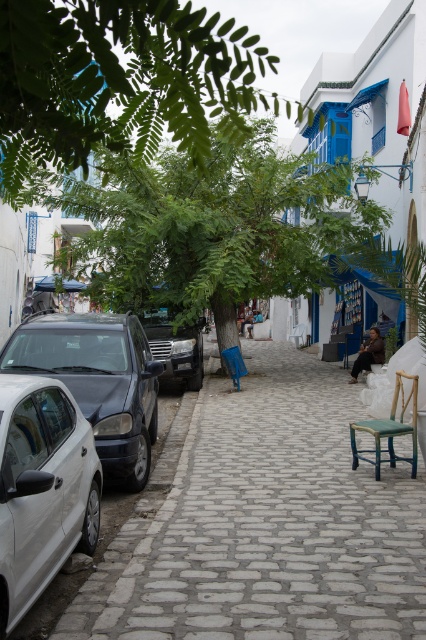
Is green leafy tree at center further to the viewer compared to shiny black car at left?

That is False.

Who is more forward, (112, 262) or (132, 394)?

Point (132, 394) is more forward.

Between point (118, 186) and point (157, 417), which one is positioned behind?

Point (118, 186)

You are a GUI agent. You are given a task and a screenshot of the screen. Output one action in this format:
    pyautogui.click(x=<x>, y=<y>)
    Task: Click on the green leafy tree at center
    
    Given the screenshot: What is the action you would take?
    pyautogui.click(x=213, y=228)

Between teal wooden chair at center and brown leather chair at center, which one is positioned lower?

teal wooden chair at center

Describe the element at coordinates (388, 428) in the screenshot. The image size is (426, 640). I see `teal wooden chair at center` at that location.

This screenshot has height=640, width=426. What are the coordinates of `teal wooden chair at center` in the screenshot? It's located at (388, 428).

Does point (129, 70) lie in front of point (149, 317)?

Yes, point (129, 70) is in front of point (149, 317).

Who is taller, green leafy tree at upper left or matte black car at center?

With more height is green leafy tree at upper left.

What are the coordinates of `green leafy tree at upper left` in the screenshot? It's located at (118, 83).

Image resolution: width=426 pixels, height=640 pixels. Identify the location of green leafy tree at upper left. (118, 83).